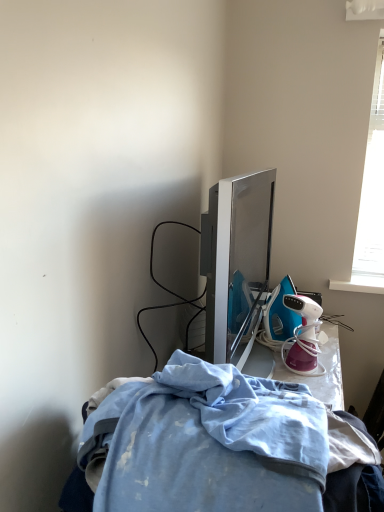
Question: Does pink glossy garment steamer at right turn towards light blue fabric at lower center?

Choices:
 (A) yes
 (B) no

Answer: (B)

Question: Is pink glossy garment steamer at right positioned with its back to light blue fabric at lower center?

Choices:
 (A) no
 (B) yes

Answer: (A)

Question: Is pink glossy garment steamer at right positioned behind light blue fabric at lower center?

Choices:
 (A) no
 (B) yes

Answer: (B)

Question: Considering the relative sizes of pink glossy garment steamer at right and light blue fabric at lower center in the image provided, is pink glossy garment steamer at right smaller than light blue fabric at lower center?

Choices:
 (A) no
 (B) yes

Answer: (B)

Question: Is pink glossy garment steamer at right far from light blue fabric at lower center?

Choices:
 (A) yes
 (B) no

Answer: (B)

Question: Is pink glossy garment steamer at right directly adjacent to light blue fabric at lower center?

Choices:
 (A) yes
 (B) no

Answer: (B)

Question: From a real-world perspective, is light blue fabric at lower center positioned over pink glossy garment steamer at right based on gravity?

Choices:
 (A) no
 (B) yes

Answer: (B)

Question: From a real-world perspective, is light blue fabric at lower center positioned under pink glossy garment steamer at right based on gravity?

Choices:
 (A) yes
 (B) no

Answer: (B)

Question: Does light blue fabric at lower center appear on the left side of pink glossy garment steamer at right?

Choices:
 (A) yes
 (B) no

Answer: (A)

Question: Considering the relative sizes of light blue fabric at lower center and pink glossy garment steamer at right in the image provided, is light blue fabric at lower center shorter than pink glossy garment steamer at right?

Choices:
 (A) no
 (B) yes

Answer: (A)

Question: Can you confirm if light blue fabric at lower center is wider than pink glossy garment steamer at right?

Choices:
 (A) yes
 (B) no

Answer: (A)

Question: Does light blue fabric at lower center have a larger size compared to pink glossy garment steamer at right?

Choices:
 (A) no
 (B) yes

Answer: (B)

Question: In terms of height, does pink glossy garment steamer at right look taller or shorter compared to light blue fabric at lower center?

Choices:
 (A) tall
 (B) short

Answer: (B)